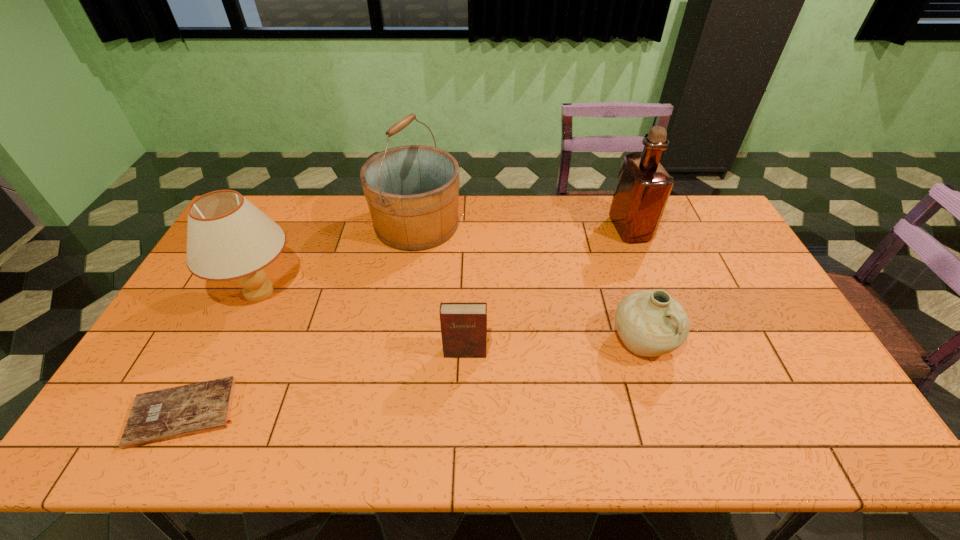
Locate an element on the screen. This screenshot has height=540, width=960. blank space located 0.190m on the right of the pottery is located at coordinates (746, 341).

Locate an element on the screen. The height and width of the screenshot is (540, 960). free region located on the front cover of the diary is located at coordinates [464, 377].

Locate an element on the screen. This screenshot has width=960, height=540. free location located 0.380m on the back of the shortest object is located at coordinates (254, 275).

The image size is (960, 540). In order to click on bucket that is at the far edge in this screenshot , I will do `click(412, 191)`.

Locate an element on the screen. Image resolution: width=960 pixels, height=540 pixels. liquor at the far edge is located at coordinates (643, 186).

This screenshot has height=540, width=960. Identify the location of object present at the near edge. (162, 415).

Identify the location of lampshade at the left edge. This screenshot has height=540, width=960. (228, 238).

Image resolution: width=960 pixels, height=540 pixels. Find the location of `Bible present at the left edge`. Bible present at the left edge is located at coordinates (162, 415).

Where is `object positioned at the near left corner`? object positioned at the near left corner is located at coordinates (162, 415).

Locate an element on the screen. The width and height of the screenshot is (960, 540). free space at the far edge is located at coordinates (330, 219).